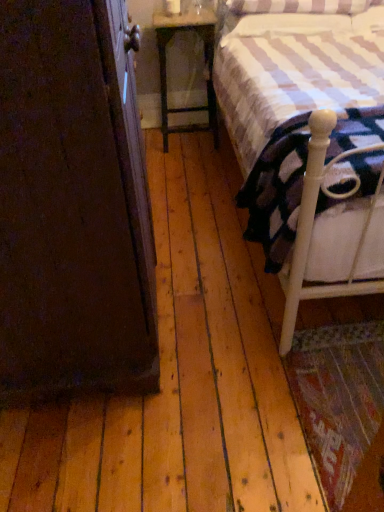
I want to click on free space in front of dark wood armoire at left, so click(150, 447).